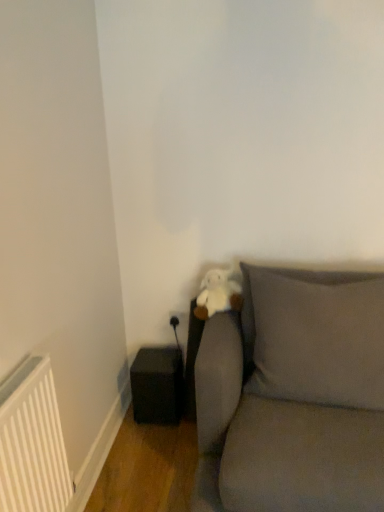
Measure the distance between white plush toy at center and camera.

white plush toy at center and camera are 1.94 meters apart from each other.

This screenshot has height=512, width=384. In order to click on gray fabric couch at lower right in this screenshot , I will do `click(293, 396)`.

Locate an element on the screen. Image resolution: width=384 pixels, height=512 pixels. matte gray pillow at center is located at coordinates (316, 336).

Locate an element on the screen. The height and width of the screenshot is (512, 384). black matte speaker at lower left is located at coordinates (157, 385).

The image size is (384, 512). I want to click on white plush toy at center, so click(219, 293).

Is white matte radiator at lower left to the left of white plush toy at center from the viewer's perspective?

Correct, you'll find white matte radiator at lower left to the left of white plush toy at center.

Does white matte radiator at lower left have a greater height compared to white plush toy at center?

Yes, white matte radiator at lower left is taller than white plush toy at center.

From a real-world perspective, is white matte radiator at lower left positioned over white plush toy at center based on gravity?

Incorrect, from a real-world perspective, white matte radiator at lower left is lower than white plush toy at center.

Is matte gray pillow at center further to camera compared to black matte speaker at lower left?

No, it is in front of black matte speaker at lower left.

Identify the location of speaker directly beneath the matte gray pillow at center (from a real-world perspective). (157, 385).

Is point (350, 291) behind point (141, 418)?

That is False.

Consider the image. Is matte gray pillow at center bigger or smaller than black matte speaker at lower left?

matte gray pillow at center is bigger than black matte speaker at lower left.

The image size is (384, 512). In order to click on radiator lying in front of the black matte speaker at lower left in this screenshot , I will do `click(32, 442)`.

Could you tell me if white matte radiator at lower left is facing black matte speaker at lower left?

No, white matte radiator at lower left does not turn towards black matte speaker at lower left.

From the image's perspective, between white matte radiator at lower left and black matte speaker at lower left, which one is located above?

white matte radiator at lower left, from the image's perspective.

Does white matte radiator at lower left have a greater width compared to black matte speaker at lower left?

In fact, white matte radiator at lower left might be narrower than black matte speaker at lower left.

You are a GUI agent. You are given a task and a screenshot of the screen. Output one action in this format:
    pyautogui.click(x=<x>, y=<y>)
    Task: Click on the pillow that appears on the right of white matte radiator at lower left
    This screenshot has width=384, height=512.
    Given the screenshot: What is the action you would take?
    pyautogui.click(x=316, y=336)

Which of these two, white matte radiator at lower left or matte gray pillow at center, is thinner?

Thinner between the two is white matte radiator at lower left.

Is white matte radiator at lower left positioned behind matte gray pillow at center?

No, white matte radiator at lower left is closer to the viewer.

Does white matte radiator at lower left appear on the left side of matte gray pillow at center?

Yes.

Can you tell me how much gray fabric couch at lower right and white matte radiator at lower left differ in facing direction?

gray fabric couch at lower right and white matte radiator at lower left are facing 90.5 degrees away from each other.

Does gray fabric couch at lower right have a lesser width compared to white matte radiator at lower left?

No, gray fabric couch at lower right is not thinner than white matte radiator at lower left.

Is gray fabric couch at lower right next to white matte radiator at lower left?

No, gray fabric couch at lower right is not making contact with white matte radiator at lower left.

Is gray fabric couch at lower right situated inside white matte radiator at lower left or outside?

gray fabric couch at lower right cannot be found inside white matte radiator at lower left.

You are a GUI agent. You are given a task and a screenshot of the screen. Output one action in this format:
    pyautogui.click(x=<x>, y=<y>)
    Task: Click on the toy in front of the black matte speaker at lower left
    The image size is (384, 512).
    Given the screenshot: What is the action you would take?
    pyautogui.click(x=219, y=293)

Which of these two, black matte speaker at lower left or white plush toy at center, is smaller?

white plush toy at center.

In terms of width, does black matte speaker at lower left look wider or thinner when compared to white plush toy at center?

Considering their sizes, black matte speaker at lower left looks broader than white plush toy at center.

Looking at their sizes, would you say black matte speaker at lower left is wider or thinner than white matte radiator at lower left?

black matte speaker at lower left is wider than white matte radiator at lower left.

How distant is black matte speaker at lower left from white matte radiator at lower left?

black matte speaker at lower left and white matte radiator at lower left are 30.99 inches apart.

Are black matte speaker at lower left and white matte radiator at lower left beside each other?

black matte speaker at lower left is not next to white matte radiator at lower left, and they're not touching.

The height and width of the screenshot is (512, 384). I want to click on toy located on the right of white matte radiator at lower left, so click(x=219, y=293).

The width and height of the screenshot is (384, 512). Identify the location of speaker behind the matte gray pillow at center. (157, 385).

Looking at the image, which one is located closer to black matte speaker at lower left, white matte radiator at lower left or gray fabric couch at lower right?

The object closer to black matte speaker at lower left is gray fabric couch at lower right.

Which object lies further to the anchor point white matte radiator at lower left, gray fabric couch at lower right or white plush toy at center?

white plush toy at center.

From the image, which object appears to be nearer to white matte radiator at lower left, black matte speaker at lower left or gray fabric couch at lower right?

gray fabric couch at lower right lies closer to white matte radiator at lower left than the other object.

Looking at the image, which one is located closer to matte gray pillow at center, white matte radiator at lower left or white plush toy at center?

Among the two, white plush toy at center is located nearer to matte gray pillow at center.

From the image, which object appears to be farther from white plush toy at center, matte gray pillow at center or white matte radiator at lower left?

Based on the image, white matte radiator at lower left appears to be further to white plush toy at center.

When comparing their distances from white matte radiator at lower left, does white plush toy at center or black matte speaker at lower left seem further?

white plush toy at center is further to white matte radiator at lower left.

From the image, which object appears to be farther from matte gray pillow at center, gray fabric couch at lower right or black matte speaker at lower left?

Based on the image, black matte speaker at lower left appears to be further to matte gray pillow at center.

From the image, which object appears to be farther from white plush toy at center, black matte speaker at lower left or matte gray pillow at center?

black matte speaker at lower left.

This screenshot has width=384, height=512. In order to click on studio couch located between white matte radiator at lower left and matte gray pillow at center in the left-right direction in this screenshot , I will do `click(293, 396)`.

At what (x,y) coordinates should I click in order to perform the action: click on toy located between white matte radiator at lower left and matte gray pillow at center in the left-right direction. Please return your answer as a coordinate pair (x, y). Looking at the image, I should click on (219, 293).

Locate an element on the screen. This screenshot has width=384, height=512. toy located between white matte radiator at lower left and gray fabric couch at lower right in the left-right direction is located at coordinates (219, 293).

The image size is (384, 512). What are the coordinates of `studio couch positioned between white matte radiator at lower left and black matte speaker at lower left from near to far` in the screenshot? It's located at (293, 396).